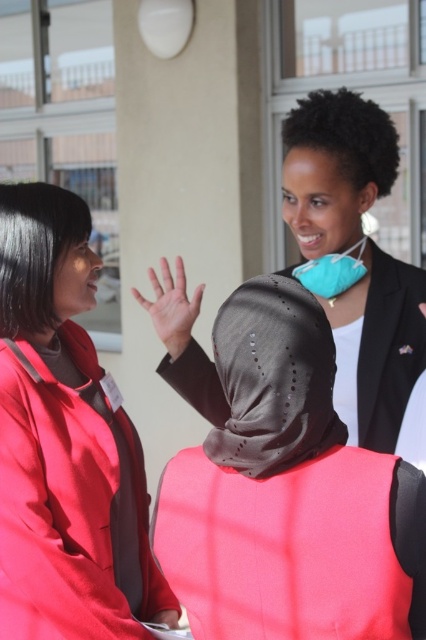
You are an interior designer observing the three people in the scene. You need to determine which item, the matte black hijab at center or the black matte shawl at center, would require more space if placed on a narrow shelf. Which one would you choose?

The matte black hijab at center is wider than the black matte shawl at center, so it would require more space and should be chosen for the narrow shelf consideration.

In the scene shown: You are an interior designer observing the three people in the scene. You need to determine if the black matte shawl at center can be placed on a shelf that is currently holding the smooth skin hand at center. Can the shawl fit on the shelf without overlapping the hand?

The black matte shawl at center occupies less space than the smooth skin hand at center, so it can fit on the shelf without overlapping the hand.